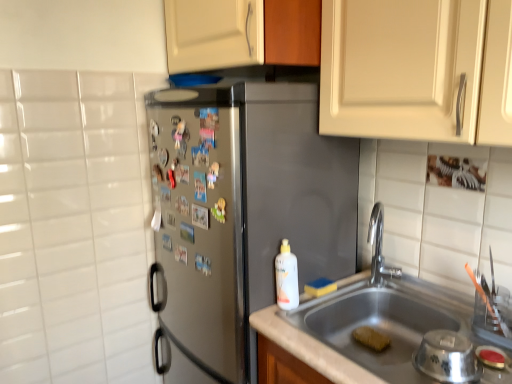
Question: Does yellow sponge at sink bottom, which appears as the 2th food when viewed from the top, come behind satin steel refrigerator at center?

Choices:
 (A) no
 (B) yes

Answer: (B)

Question: Is yellow sponge at sink bottom, which appears as the second food when viewed from the left, smaller than satin steel refrigerator at center?

Choices:
 (A) yes
 (B) no

Answer: (A)

Question: Considering the relative sizes of yellow sponge at sink bottom, which appears as the second food when viewed from the left, and satin steel refrigerator at center in the image provided, is yellow sponge at sink bottom, which appears as the second food when viewed from the left, bigger than satin steel refrigerator at center?

Choices:
 (A) yes
 (B) no

Answer: (B)

Question: Could you tell me if yellow sponge at sink bottom, arranged as the first food when ordered from the bottom, is facing satin steel refrigerator at center?

Choices:
 (A) no
 (B) yes

Answer: (A)

Question: Considering the relative sizes of yellow sponge at sink bottom, which appears as the second food when viewed from the left, and satin steel refrigerator at center in the image provided, is yellow sponge at sink bottom, which appears as the second food when viewed from the left, wider than satin steel refrigerator at center?

Choices:
 (A) yes
 (B) no

Answer: (B)

Question: From a real-world perspective, is matte white cabinet at upper center physically located above or below white matte bottle at sink?

Choices:
 (A) below
 (B) above

Answer: (B)

Question: Is matte white cabinet at upper center to the left or to the right of white matte bottle at sink in the image?

Choices:
 (A) right
 (B) left

Answer: (B)

Question: Considering the positions of matte white cabinet at upper center and white matte bottle at sink in the image, is matte white cabinet at upper center bigger or smaller than white matte bottle at sink?

Choices:
 (A) big
 (B) small

Answer: (A)

Question: Is point (196, 46) closer or farther from the camera than point (295, 271)?

Choices:
 (A) farther
 (B) closer

Answer: (A)

Question: From a real-world perspective, is yellow sponge at sink bottom, arranged as the first food when ordered from the bottom, positioned above or below white matte bottle at sink?

Choices:
 (A) above
 (B) below

Answer: (B)

Question: Would you say yellow sponge at sink bottom, which appears as the second food when viewed from the left, is inside or outside white matte bottle at sink?

Choices:
 (A) inside
 (B) outside

Answer: (B)

Question: Looking at the image, does yellow sponge at sink bottom, arranged as the first food when ordered from the bottom, seem bigger or smaller compared to white matte bottle at sink?

Choices:
 (A) big
 (B) small

Answer: (B)

Question: Is point (373, 336) positioned closer to the camera than point (283, 309)?

Choices:
 (A) closer
 (B) farther

Answer: (B)

Question: Is polished chrome faucet at sink right wider or thinner than white matte bottle at sink?

Choices:
 (A) thin
 (B) wide

Answer: (B)

Question: From a real-world perspective, is polished chrome faucet at sink right above or below white matte bottle at sink?

Choices:
 (A) below
 (B) above

Answer: (B)